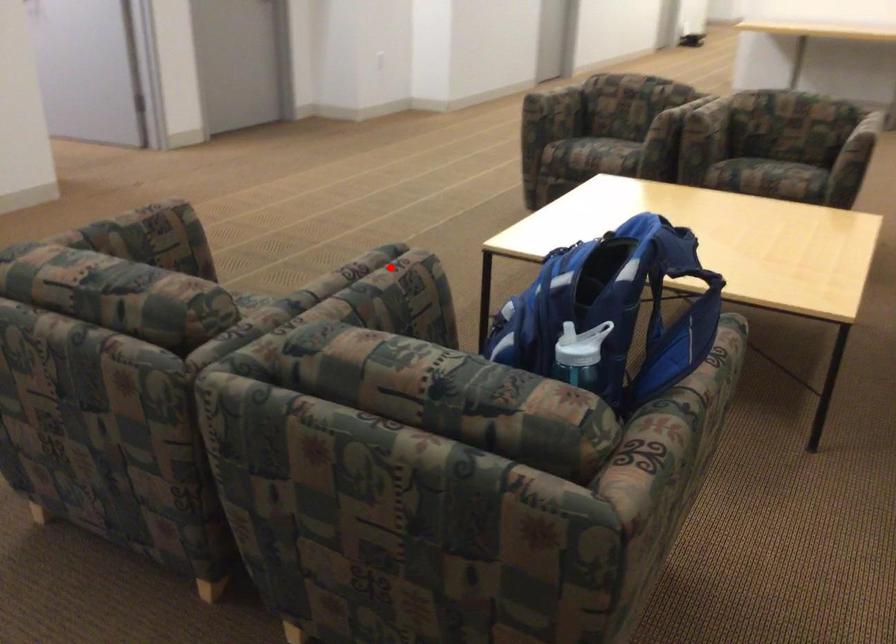
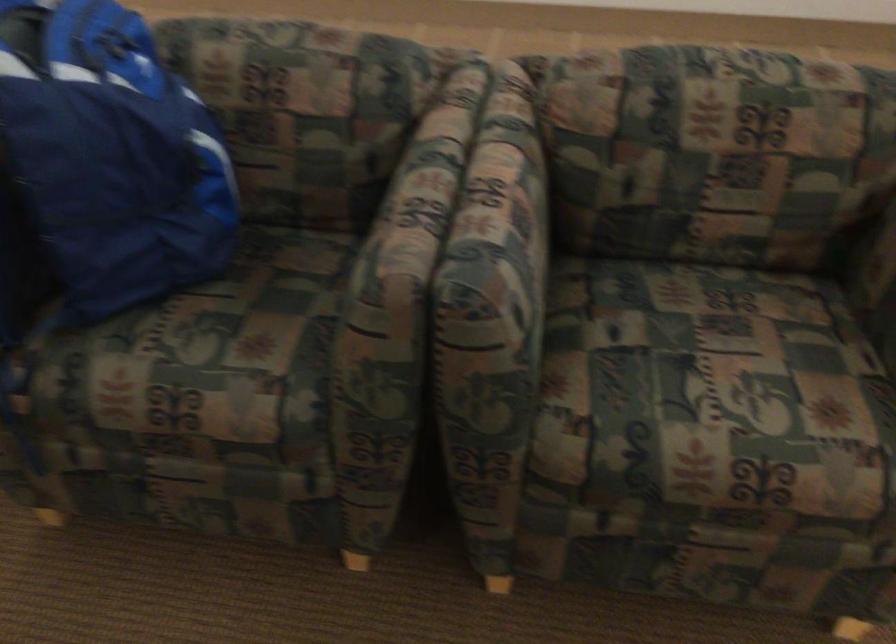
Question: I am providing you with two images of the same scene from different viewpoints. A red point is shown in image1. For the corresponding object point in image2, is it positioned nearer or farther from the camera?

Choices:
 (A) Nearer
 (B) Farther

Answer: (A)